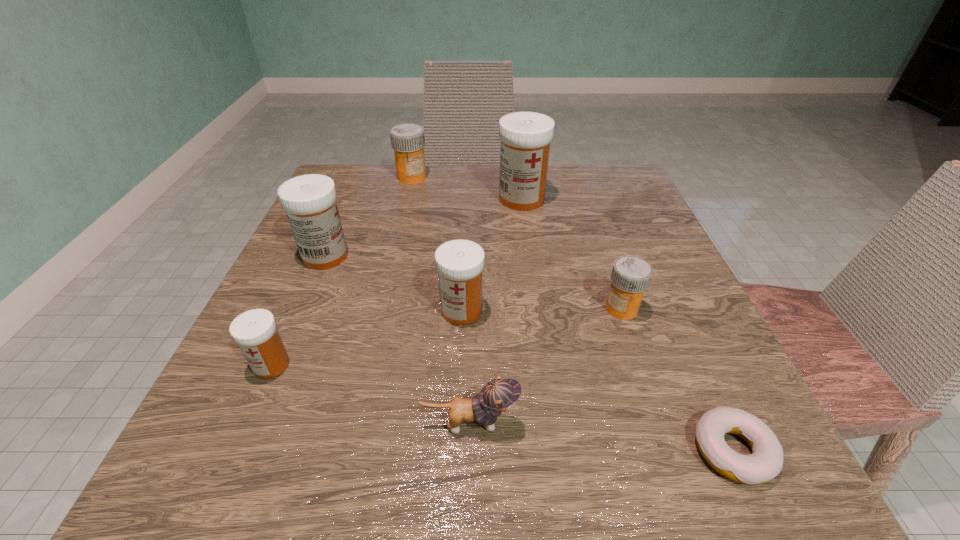
Where is `the tallest medicine`? the tallest medicine is located at coordinates (525, 136).

This screenshot has height=540, width=960. In order to click on the farthest white medicine in this screenshot , I will do `click(525, 136)`.

Locate an element on the screen. This screenshot has width=960, height=540. the third nearest white medicine is located at coordinates (309, 200).

The image size is (960, 540). I want to click on the third farthest object, so click(x=309, y=200).

Find the location of a particular element. The height and width of the screenshot is (540, 960). the left orange medicine is located at coordinates (408, 140).

Locate an element on the screen. The height and width of the screenshot is (540, 960). the sixth object from right to left is located at coordinates (408, 140).

Where is `the third medicine from right to left`? Image resolution: width=960 pixels, height=540 pixels. the third medicine from right to left is located at coordinates (459, 263).

Image resolution: width=960 pixels, height=540 pixels. Identify the location of the second nearest white medicine. (459, 263).

I want to click on the smaller orange medicine, so click(x=630, y=277).

You are a GUI agent. You are given a task and a screenshot of the screen. Output one action in this format:
    pyautogui.click(x=<x>, y=<y>)
    Task: Click on the nearer orange medicine
    Image resolution: width=960 pixels, height=540 pixels.
    Given the screenshot: What is the action you would take?
    [x=630, y=277]